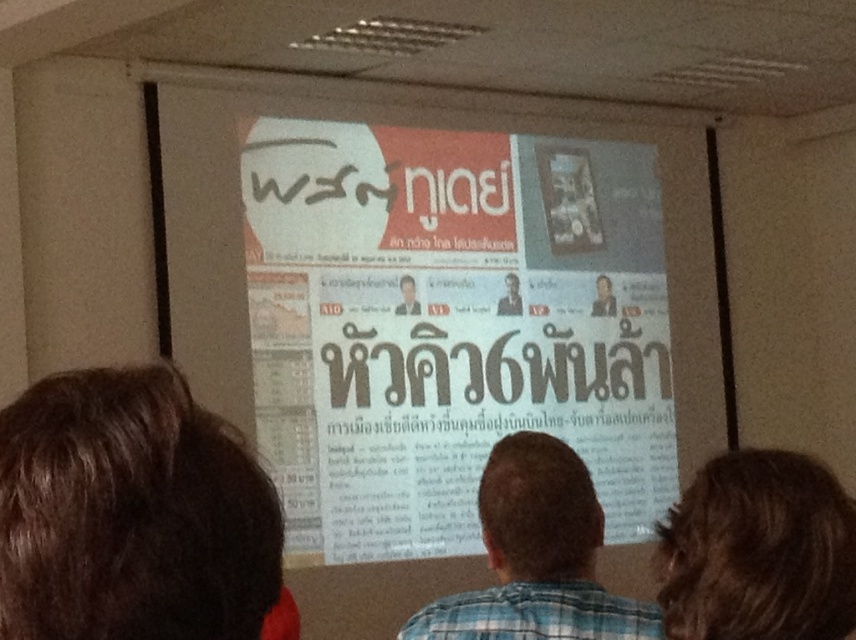
You are sitting in the audience facing the large screen. There are two points marked on the screen at coordinates point (598, 278) and point (394, 310). Which point is closer to you?

Point (394, 310) is closer to you because it is nearer than point (598, 278) which is further away from you.

You are an attendee at a presentation and you see two faces on the screen. The smooth skin face at center and the matte gray face at center. Which face is positioned to the right?

The smooth skin face at center is positioned to the right of the matte gray face at center.